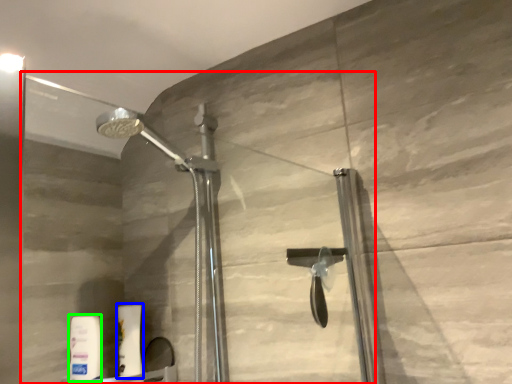
Question: Which object is the farthest from glass door (highlighted by a red box)? Choose among these: toiletry (highlighted by a blue box) or toiletry (highlighted by a green box).

Choices:
 (A) toiletry
 (B) toiletry

Answer: (B)